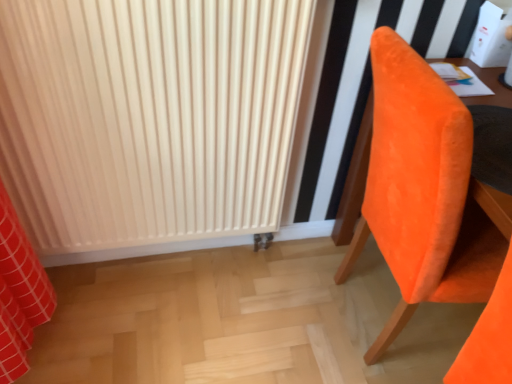
What is the approximate width of orange velvet chair at right?

orange velvet chair at right is 77.38 centimeters in width.

Find the location of a particular element. This screenshot has height=384, width=512. orange velvet chair at right is located at coordinates (418, 190).

This screenshot has height=384, width=512. What do you see at coordinates (418, 190) in the screenshot?
I see `orange velvet chair at right` at bounding box center [418, 190].

What is the approximate width of matte white radiator at center?

matte white radiator at center is 3.42 inches wide.

Locate an element on the screen. The image size is (512, 384). matte white radiator at center is located at coordinates (147, 120).

This screenshot has width=512, height=384. What do you see at coordinates (147, 120) in the screenshot?
I see `matte white radiator at center` at bounding box center [147, 120].

The height and width of the screenshot is (384, 512). Identify the location of orange velvet chair at right. (418, 190).

Is matte white radiator at center at the right side of orange velvet chair at right?

No.

Is matte white radiator at center further to the viewer compared to orange velvet chair at right?

Yes, matte white radiator at center is further from the camera.

Considering the points (37, 61) and (411, 296), which point is behind, point (37, 61) or point (411, 296)?

Point (411, 296)

From the image's perspective, which one is positioned higher, matte white radiator at center or orange velvet chair at right?

From the image's view, matte white radiator at center is above.

From a real-world perspective, is matte white radiator at center located beneath orange velvet chair at right?

No, from a real-world perspective, matte white radiator at center is not below orange velvet chair at right.

Based on the photo, which of these two, matte white radiator at center or orange velvet chair at right, is thinner?

matte white radiator at center.

Between matte white radiator at center and orange velvet chair at right, which one has more height?

matte white radiator at center.

Consider the image. Between matte white radiator at center and orange velvet chair at right, which one has smaller size?

Smaller between the two is matte white radiator at center.

Consider the image. Is matte white radiator at center not within orange velvet chair at right?

Yes, matte white radiator at center is outside of orange velvet chair at right.

Can you see matte white radiator at center touching orange velvet chair at right?

No, matte white radiator at center is not next to orange velvet chair at right.

Could you tell me if matte white radiator at center is facing orange velvet chair at right?

No.

Can you tell me how much matte white radiator at center and orange velvet chair at right differ in facing direction?

They differ by 0.798 degrees in their facing directions.

Locate an element on the screen. Image resolution: width=512 pixels, height=384 pixels. chair located below the matte white radiator at center (from the image's perspective) is located at coordinates (418, 190).

Is orange velvet chair at right at the left side of matte white radiator at center?

No, orange velvet chair at right is not to the left of matte white radiator at center.

Is orange velvet chair at right positioned in front of matte white radiator at center?

Yes, orange velvet chair at right is in front of matte white radiator at center.

Is point (378, 57) more distant than point (203, 157)?

No, (378, 57) is in front of (203, 157).

From the image's perspective, between orange velvet chair at right and matte white radiator at center, which one is located above?

matte white radiator at center appears higher in the image.

From a real-world perspective, is orange velvet chair at right physically located above or below matte white radiator at center?

Clearly, from a real-world perspective, orange velvet chair at right is below matte white radiator at center.

Is orange velvet chair at right wider than matte white radiator at center?

Yes, orange velvet chair at right is wider than matte white radiator at center.

Can you confirm if orange velvet chair at right is taller than matte white radiator at center?

No, orange velvet chair at right is not taller than matte white radiator at center.

Does orange velvet chair at right have a smaller size compared to matte white radiator at center?

No, orange velvet chair at right is not smaller than matte white radiator at center.

Is orange velvet chair at right completely or partially outside of matte white radiator at center?

Yes, orange velvet chair at right is outside of matte white radiator at center.

Is orange velvet chair at right next to matte white radiator at center?

orange velvet chair at right and matte white radiator at center are not in contact.

Is orange velvet chair at right facing towards matte white radiator at center?

No, orange velvet chair at right is not aimed at matte white radiator at center.

How many degrees apart are the facing directions of orange velvet chair at right and matte white radiator at center?

0.798 degrees separate the facing orientations of orange velvet chair at right and matte white radiator at center.

How distant is orange velvet chair at right from matte white radiator at center?

orange velvet chair at right is 53.22 centimeters from matte white radiator at center.

Locate an element on the screen. radiator behind the orange velvet chair at right is located at coordinates [147, 120].

Locate an element on the screen. The height and width of the screenshot is (384, 512). radiator above the orange velvet chair at right (from the image's perspective) is located at coordinates (147, 120).

Locate an element on the screen. chair below the matte white radiator at center (from the image's perspective) is located at coordinates (418, 190).